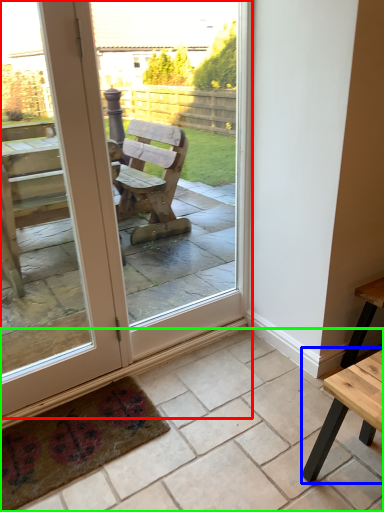
Question: Estimate the real-world distances between objects in this image. Which object is farther from door (highlighted by a red box), table (highlighted by a blue box) or tile (highlighted by a green box)?

Choices:
 (A) table
 (B) tile

Answer: (A)